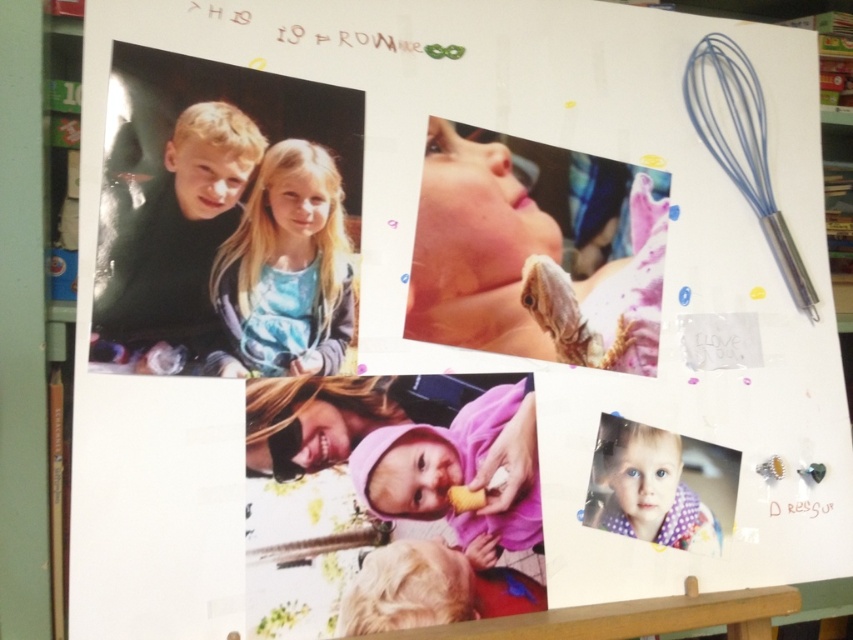
You are an interior designer planning to hang a new picture between the matte black shirt at upper left and the polka dot fabric at lower right on the whiteboard. The picture frame you have is 18 inches wide. Will it fit between them?

The distance between the matte black shirt at upper left and the polka dot fabric at lower right is 17.98 inches. Since the picture frame is 18 inches wide, it will not fit between them as the available space is slightly narrower.

Looking at the whiteboard, you notice two items pinned to it. The first is a matte black shirt at upper left, and the second is a polka dot fabric at lower right. Which of these two items is positioned higher up on the whiteboard?

The matte black shirt at upper left is positioned higher up on the whiteboard compared to the polka dot fabric at lower right.